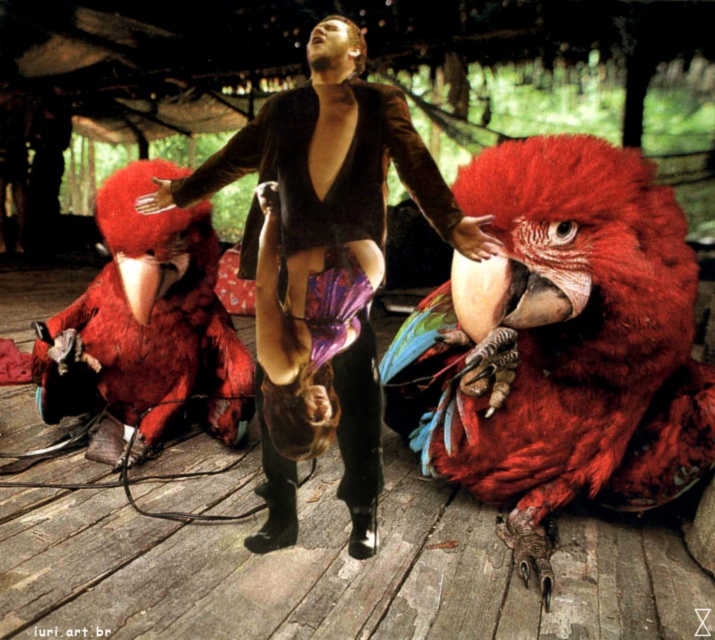
In the scene shown: You are an observer standing in front of the scene. You see the velvet brown jacket at center and the shiny red parrot at left. Which object is positioned more to the left side of the scene?

The shiny red parrot at left is positioned more to the left side of the scene than the velvet brown jacket at center.

You are an artist planning to paint this scene. You want to ensure the velvet brown jacket at center and shiny red parrot at left are proportionally accurate. Which object should you paint wider to maintain the correct proportions?

The velvet brown jacket at center should be painted wider than the shiny red parrot at left since its width surpasses the parrot.